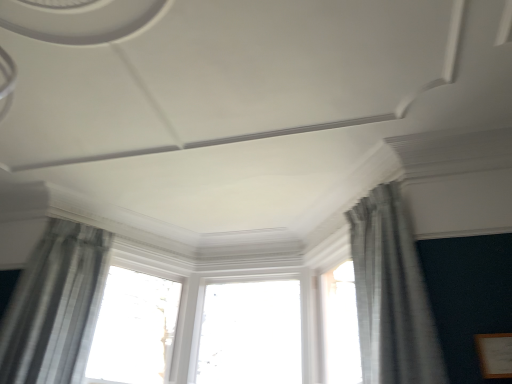
Question: From a real-world perspective, is white glossy window at center physically below gray sheer curtain at upper right, the 2th curtain positioned from the left?

Choices:
 (A) yes
 (B) no

Answer: (B)

Question: Would you say white glossy window at center contains gray sheer curtain at upper right, acting as the 1th curtain starting from the right?

Choices:
 (A) no
 (B) yes

Answer: (A)

Question: Considering the relative positions of white glossy window at center and gray sheer curtain at upper right, the 2th curtain positioned from the left, in the image provided, is white glossy window at center in front of gray sheer curtain at upper right, the 2th curtain positioned from the left,?

Choices:
 (A) no
 (B) yes

Answer: (A)

Question: Is white glossy window at center looking in the opposite direction of gray sheer curtain at upper right, the 2th curtain positioned from the left?

Choices:
 (A) yes
 (B) no

Answer: (B)

Question: Is white glossy window at center in contact with gray sheer curtain at upper right, the 2th curtain positioned from the left?

Choices:
 (A) yes
 (B) no

Answer: (B)

Question: In terms of height, does sheer gray curtain at left, marked as the second curtain in a right-to-left arrangement, look taller or shorter compared to gray sheer curtain at upper right, the 2th curtain positioned from the left?

Choices:
 (A) short
 (B) tall

Answer: (B)

Question: In the image, is sheer gray curtain at left, the 1th curtain positioned from the left, on the left side or the right side of gray sheer curtain at upper right, acting as the 1th curtain starting from the right?

Choices:
 (A) left
 (B) right

Answer: (A)

Question: From the image's perspective, is sheer gray curtain at left, the 1th curtain positioned from the left, above or below gray sheer curtain at upper right, the 2th curtain positioned from the left?

Choices:
 (A) above
 (B) below

Answer: (B)

Question: In terms of size, does sheer gray curtain at left, marked as the second curtain in a right-to-left arrangement, appear bigger or smaller than gray sheer curtain at upper right, acting as the 1th curtain starting from the right?

Choices:
 (A) small
 (B) big

Answer: (B)

Question: From a real-world perspective, is white glossy window at center positioned above or below gray sheer curtain at upper right, the 2th curtain positioned from the left?

Choices:
 (A) below
 (B) above

Answer: (B)

Question: From the image's perspective, is white glossy window at center positioned above or below gray sheer curtain at upper right, the 2th curtain positioned from the left?

Choices:
 (A) below
 (B) above

Answer: (A)

Question: Is point (140, 317) positioned closer to the camera than point (362, 279)?

Choices:
 (A) farther
 (B) closer

Answer: (A)

Question: Which is correct: white glossy window at center is inside gray sheer curtain at upper right, the 2th curtain positioned from the left, or outside of it?

Choices:
 (A) inside
 (B) outside

Answer: (B)

Question: From the image's perspective, is gray sheer curtain at upper right, the 2th curtain positioned from the left, positioned above or below white glossy window at center?

Choices:
 (A) above
 (B) below

Answer: (A)

Question: Is gray sheer curtain at upper right, acting as the 1th curtain starting from the right, to the left or to the right of white glossy window at center in the image?

Choices:
 (A) left
 (B) right

Answer: (B)